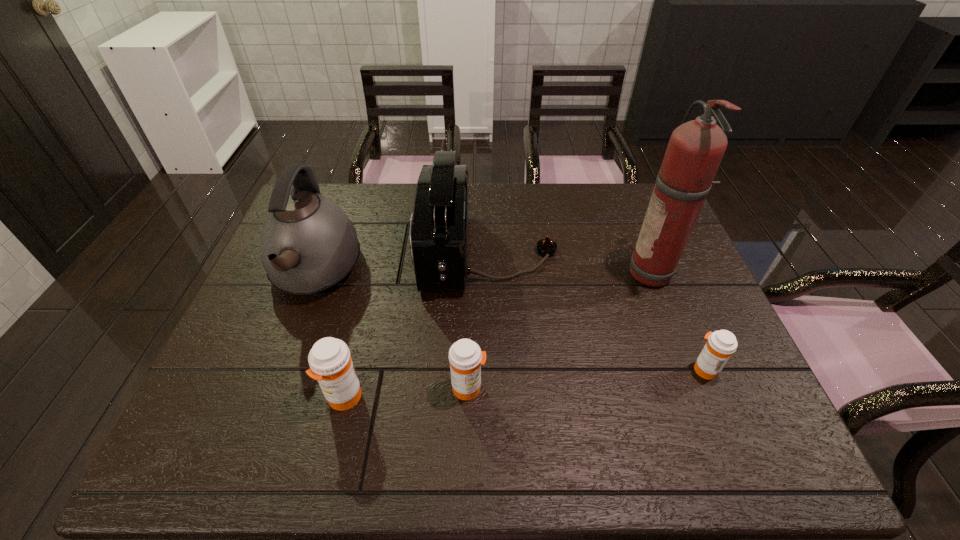
Find the location of `free space between the kettle and the shortest object`. free space between the kettle and the shortest object is located at coordinates (510, 321).

Locate an element on the screen. This screenshot has width=960, height=540. vacant area that lies between the fire extinguisher and the radio receiver is located at coordinates (571, 264).

At what (x,y) coordinates should I click in order to perform the action: click on free space between the second shortest object and the kettle. Please return your answer as a coordinate pair (x, y). The height and width of the screenshot is (540, 960). Looking at the image, I should click on (392, 331).

Locate an element on the screen. The width and height of the screenshot is (960, 540). vacant point located between the shortest object and the radio receiver is located at coordinates (596, 311).

I want to click on unoccupied area between the leftmost medicine and the radio receiver, so click(x=416, y=326).

Identify the location of object that is the third closest to the leftmost medicine. This screenshot has width=960, height=540. (439, 226).

This screenshot has height=540, width=960. I want to click on the second closest object relative to the fifth tallest object, so click(439, 226).

Identify the location of medicine that is the second closest to the kettle. This screenshot has width=960, height=540. (465, 356).

Select which medicine is the second closest to the leftmost medicine. Please provide its 2D coordinates. Your answer should be formatted as a tuple, i.e. [(x, y)], where the tuple contains the x and y coordinates of a point satisfying the conditions above.

[(721, 344)]

The width and height of the screenshot is (960, 540). Find the location of `free spot that satisfies the following two spatial constraints: 1. on the side of the fire extinguisher with the label and nozzle; 2. on the front side of the second medicine from left to right`. free spot that satisfies the following two spatial constraints: 1. on the side of the fire extinguisher with the label and nozzle; 2. on the front side of the second medicine from left to right is located at coordinates (699, 388).